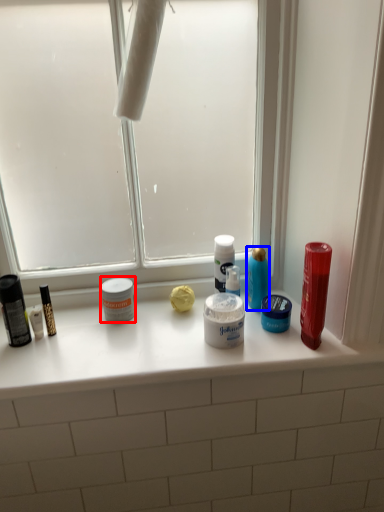
Question: Which of the following is the farthest to the observer, toiletry (highlighted by a red box) or cleaning product (highlighted by a blue box)?

Choices:
 (A) toiletry
 (B) cleaning product

Answer: (B)